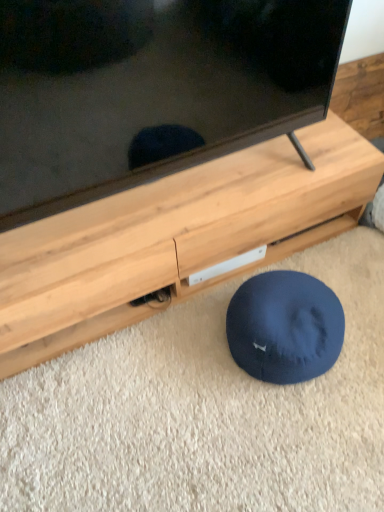
Question: Is wooden tv stand at center wider than navy blue fabric dog bed at lower center?

Choices:
 (A) yes
 (B) no

Answer: (A)

Question: Is wooden tv stand at center bigger than navy blue fabric dog bed at lower center?

Choices:
 (A) yes
 (B) no

Answer: (A)

Question: Are wooden tv stand at center and navy blue fabric dog bed at lower center far apart?

Choices:
 (A) no
 (B) yes

Answer: (A)

Question: Would you say navy blue fabric dog bed at lower center is part of wooden tv stand at center's contents?

Choices:
 (A) no
 (B) yes

Answer: (A)

Question: From the image's perspective, is wooden tv stand at center located above navy blue fabric dog bed at lower center?

Choices:
 (A) no
 (B) yes

Answer: (B)

Question: In terms of width, does navy blue fabric dog bed at lower center look wider or thinner when compared to wooden tv stand at center?

Choices:
 (A) thin
 (B) wide

Answer: (A)

Question: In terms of size, does navy blue fabric dog bed at lower center appear bigger or smaller than wooden tv stand at center?

Choices:
 (A) small
 (B) big

Answer: (A)

Question: Which is correct: navy blue fabric dog bed at lower center is inside wooden tv stand at center, or outside of it?

Choices:
 (A) inside
 (B) outside

Answer: (B)

Question: In the image, is navy blue fabric dog bed at lower center positioned in front of or behind wooden tv stand at center?

Choices:
 (A) behind
 (B) front

Answer: (A)

Question: Is wooden tv stand at center bigger or smaller than black glossy tv at upper center?

Choices:
 (A) small
 (B) big

Answer: (A)

Question: Considering the positions of wooden tv stand at center and black glossy tv at upper center in the image, is wooden tv stand at center taller or shorter than black glossy tv at upper center?

Choices:
 (A) tall
 (B) short

Answer: (B)

Question: From the image's perspective, is wooden tv stand at center positioned above or below black glossy tv at upper center?

Choices:
 (A) below
 (B) above

Answer: (A)

Question: Looking at their shapes, would you say wooden tv stand at center is wider or thinner than black glossy tv at upper center?

Choices:
 (A) thin
 (B) wide

Answer: (B)

Question: Based on their positions, is black glossy tv at upper center located to the left or right of wooden tv stand at center?

Choices:
 (A) right
 (B) left

Answer: (B)

Question: Is black glossy tv at upper center spatially inside wooden tv stand at center, or outside of it?

Choices:
 (A) outside
 (B) inside

Answer: (A)